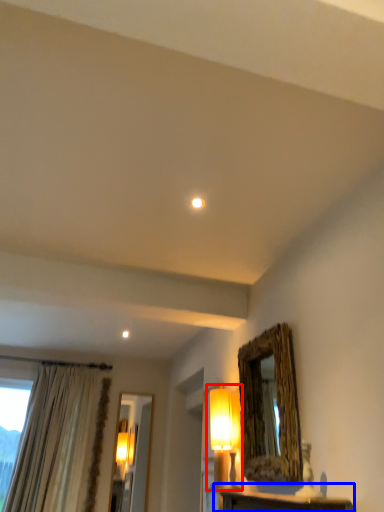
Question: Which point is further to the camera, table lamp (highlighted by a red box) or table (highlighted by a blue box)?

Choices:
 (A) table lamp
 (B) table

Answer: (A)